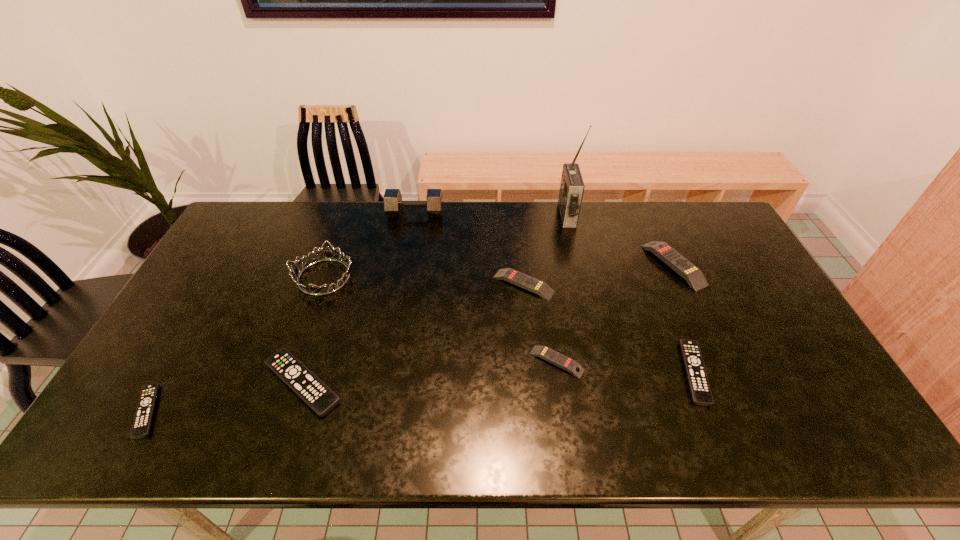
Find the location of a particular element. This screenshot has height=540, width=960. free space located on the back of the second smallest yellow remote control is located at coordinates (517, 219).

I want to click on vacant space situated on the left of the second black remote control from right to left, so click(x=184, y=383).

The width and height of the screenshot is (960, 540). I want to click on vacant region located 0.380m on the right of the smallest yellow remote control, so click(x=728, y=361).

Identify the location of free space located 0.260m on the back of the second smallest black remote control. (656, 275).

Find the location of a particular element. free space located 0.250m on the right of the smallest black remote control is located at coordinates tap(268, 411).

Where is `radio receiver that is positioned at the far edge`? radio receiver that is positioned at the far edge is located at coordinates (571, 191).

Where is `dumbbell at the far edge`? dumbbell at the far edge is located at coordinates (393, 204).

Where is `remote control at the far edge`? The width and height of the screenshot is (960, 540). remote control at the far edge is located at coordinates (693, 275).

At what (x,y) coordinates should I click in order to perform the action: click on object that is at the left edge. Please return your answer as a coordinate pair (x, y). This screenshot has width=960, height=540. Looking at the image, I should click on (143, 417).

Image resolution: width=960 pixels, height=540 pixels. Identify the location of object that is positioned at the near left corner. 143,417.